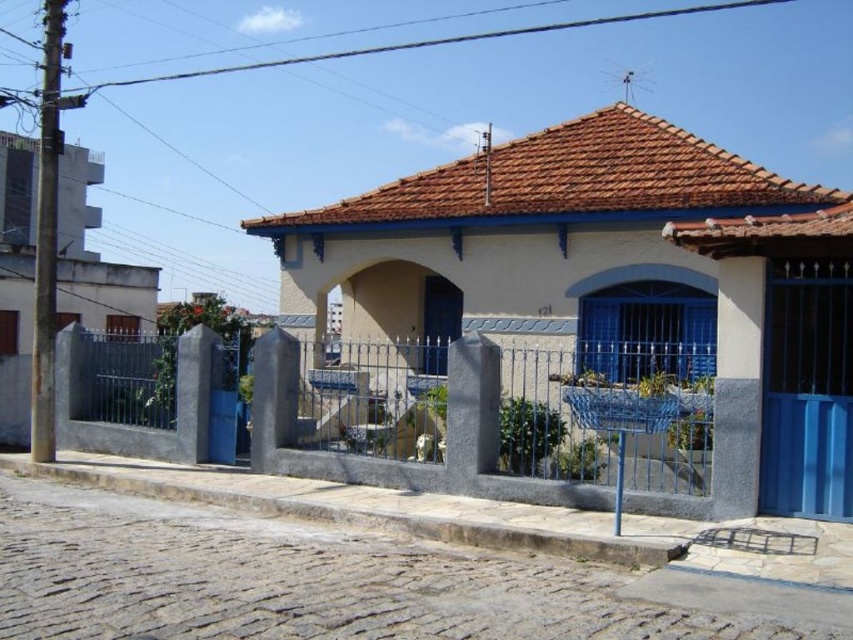
Consider the image. You are standing in front of the house and want to enter through the gate. Which object, the gray wrought iron fence at center or the brown tile roof at upper center, is closer to you as you approach the entrance?

The gray wrought iron fence at center is closer to you because it is located below the brown tile roof at upper center, meaning it is positioned lower and nearer to your viewpoint as you approach the entrance.

You are standing in front of the house and want to enter through the gate. The gray wrought iron fence at center and the brown tile roof at upper center are in your view. Which object should you approach first to reach the entrance?

You should approach the gray wrought iron fence at center first because it is to the left of the brown tile roof at upper center, meaning it is closer to the entrance.

You are a painter who needs to decide which object to paint first between the gray wrought iron fence at center and the brown tile roof at upper center. Based on their sizes, which one should you tackle first if you want to start with the smaller one?

The gray wrought iron fence at center has a smaller size compared to the brown tile roof at upper center, so you should paint the gray wrought iron fence at center first.